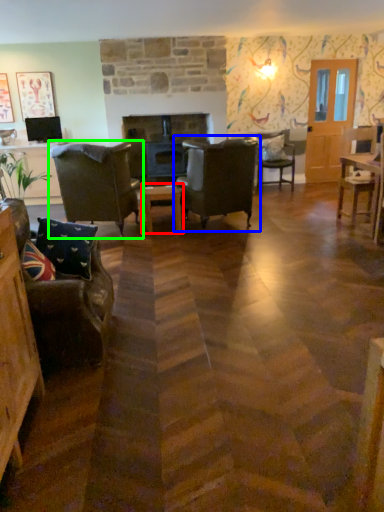
Question: Estimate the real-world distances between objects in this image. Which object is closer to table (highlighted by a red box), chair (highlighted by a blue box) or chair (highlighted by a green box)?

Choices:
 (A) chair
 (B) chair

Answer: (A)